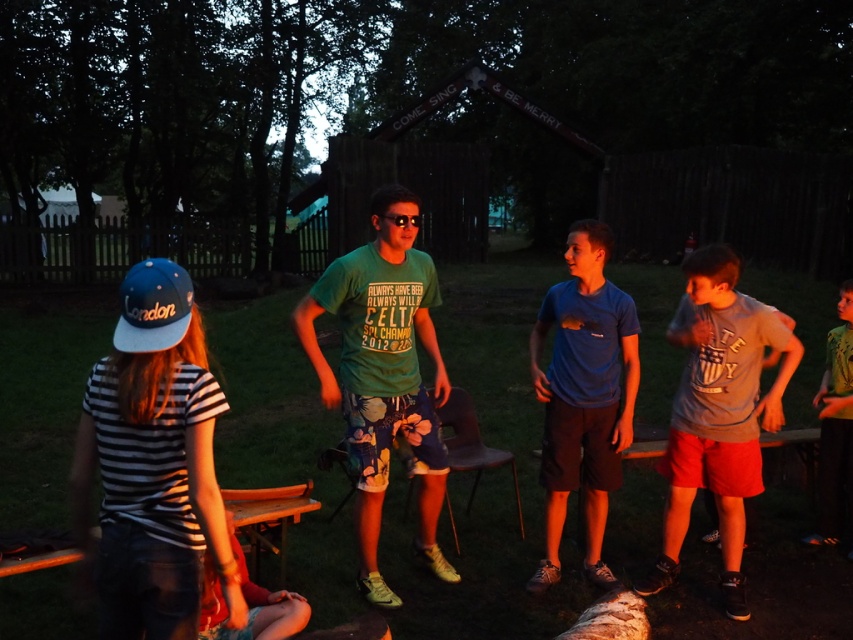
Is green cotton t-shirt at center to the left of gray cotton t-shirt at right from the viewer's perspective?

Correct, you'll find green cotton t-shirt at center to the left of gray cotton t-shirt at right.

Between green cotton t-shirt at center and gray cotton t-shirt at right, which one appears on the right side from the viewer's perspective?

From the viewer's perspective, gray cotton t-shirt at right appears more on the right side.

Where is `green cotton t-shirt at center`? The height and width of the screenshot is (640, 853). green cotton t-shirt at center is located at coordinates (384, 376).

In order to click on green cotton t-shirt at center in this screenshot , I will do `click(384, 376)`.

Between green cotton t-shirt at center and blue matte shirt at center, which one has less height?

Standing shorter between the two is blue matte shirt at center.

In the scene shown: Is green cotton t-shirt at center to the left of blue matte shirt at center from the viewer's perspective?

Indeed, green cotton t-shirt at center is positioned on the left side of blue matte shirt at center.

Measure the distance between green cotton t-shirt at center and camera.

green cotton t-shirt at center is 4.27 meters from camera.

Where is `green cotton t-shirt at center`? green cotton t-shirt at center is located at coordinates (384, 376).

The image size is (853, 640). Identify the location of green cotton t-shirt at center. (384, 376).

Does green cotton t-shirt at center have a smaller size compared to green t-shirt at center?

No, green cotton t-shirt at center is not smaller than green t-shirt at center.

Does point (387, 401) come in front of point (839, 502)?

Yes, it is in front of point (839, 502).

At what (x,y) coordinates should I click in order to perform the action: click on green cotton t-shirt at center. Please return your answer as a coordinate pair (x, y). This screenshot has width=853, height=640. Looking at the image, I should click on (384, 376).